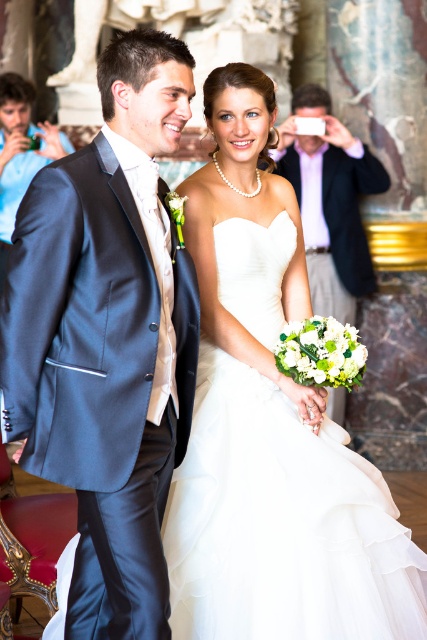
You are a photographer standing at the back of the hall. You need to capture a photo that includes both the white tulle dress at center and the matte white shirt at upper center. Given that your camera has a maximum focus range of 10 meters, will you be able to get both subjects in focus?

The white tulle dress at center and the matte white shirt at upper center are 10.46 meters apart from each other. Since the distance exceeds the camera maximum focus range of 10 meters, you won the both subjects in focus.

You are a photographer at the wedding and need to capture a shot that includes both the white tulle dress at center and the matte white shirt at upper center. Based on their positions, which one is located to the left of the other?

The white tulle dress at center is positioned on the left side of matte white shirt at upper center.